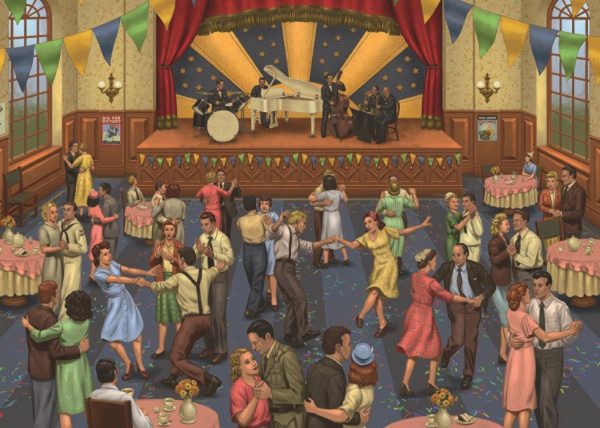
This screenshot has height=428, width=600. Find the location of `flyer on left wall`. flyer on left wall is located at coordinates click(x=115, y=129).